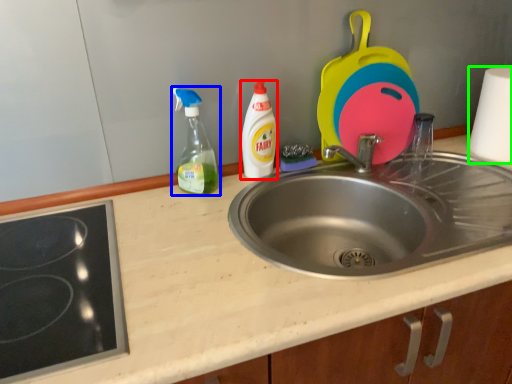
Question: Based on their relative distances, which object is nearer to bottle (highlighted by a red box)? Choose from bottle (highlighted by a blue box) and paper towel (highlighted by a green box).

Choices:
 (A) bottle
 (B) paper towel

Answer: (A)